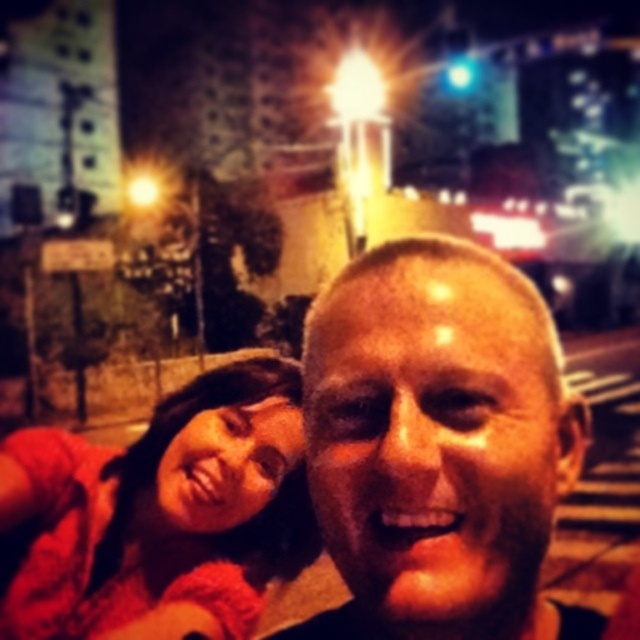
You are a photographer adjusting the lighting for a portrait. You notice the smooth skin face at center and the matte red shirt at lower left in your frame. Which object would require more space between the subject and the background to maintain focus?

The smooth skin face at center is thinner than the matte red shirt at lower left, so it would require more space between the subject and the background to maintain focus because thinner objects need more distance to keep sharpness in shallow depth of field photography.

You are a photographer trying to adjust the focus of your camera. You want to ensure that both the smooth skin face at center and the matte red shirt at lower left are in focus. Given their positions, is it possible to have both in focus simultaneously?

The smooth skin face at center is closer to the viewer than the matte red shirt at lower left. To have both in focus, you would need to adjust the camera settings to increase the depth of field, as they are at different distances from the camera.

From the picture: You are a photographer trying to adjust your camera focus. You want to ensure that the smooth skin face at center is in focus. According to the scene description, where exactly should you adjust the focus point to?

You should adjust the focus point to coordinates point (438, 445) to ensure the smooth skin face at center is in focus.